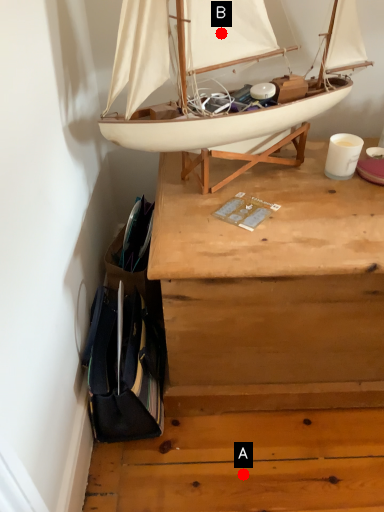
Question: Two points are circled on the image, labeled by A and B beside each circle. Which point is farther to the camera?

Choices:
 (A) A is further
 (B) B is further

Answer: (A)